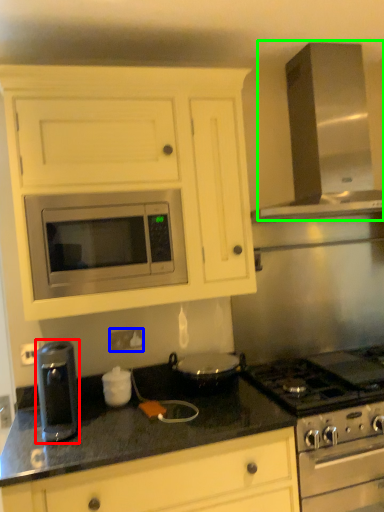
Question: Based on their relative distances, which object is farther from kitchen appliance (highlighted by a red box)? Choose from electric outlet (highlighted by a blue box) and exhaust hood (highlighted by a green box).

Choices:
 (A) electric outlet
 (B) exhaust hood

Answer: (B)